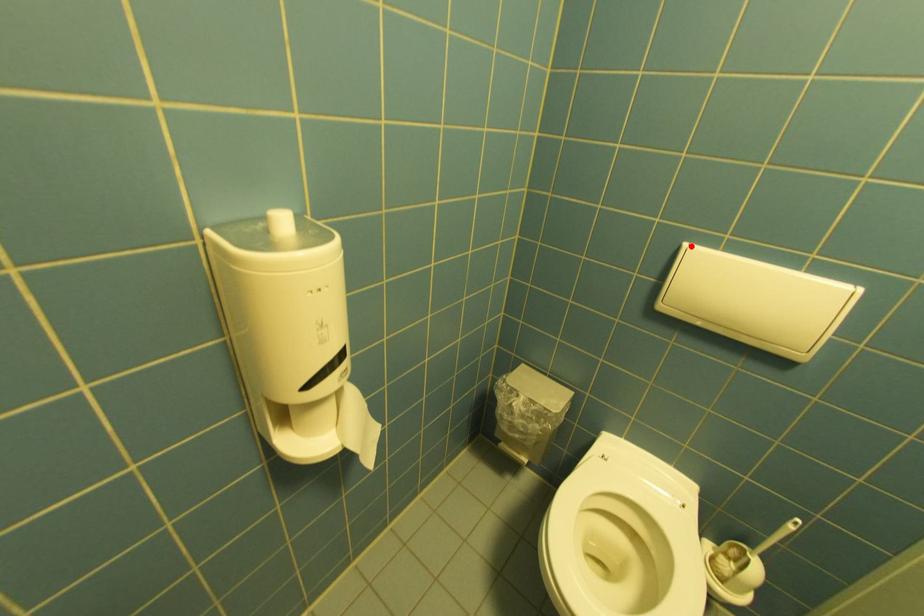
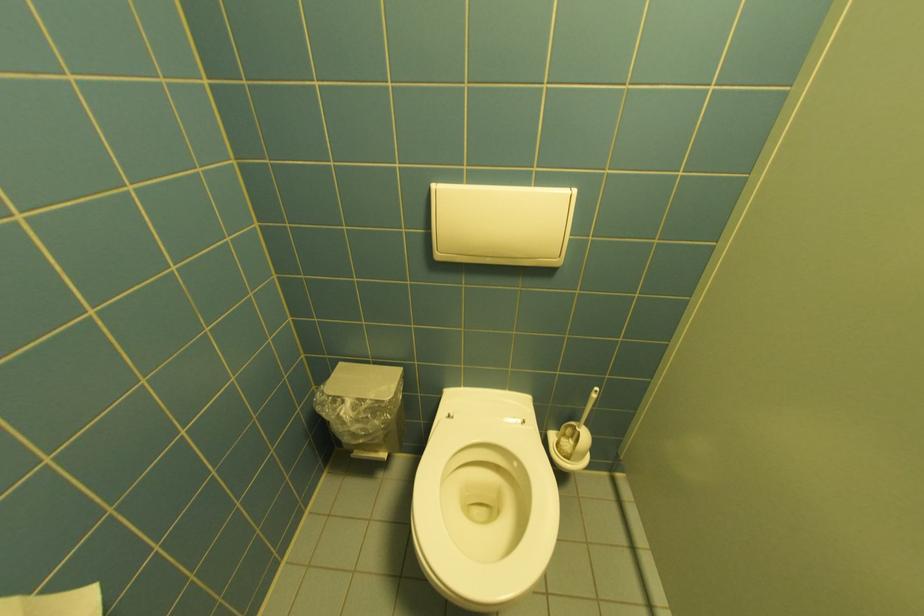
Locate, in the second image, the point that corresponds to the highlighted location in the first image.

(440, 185)